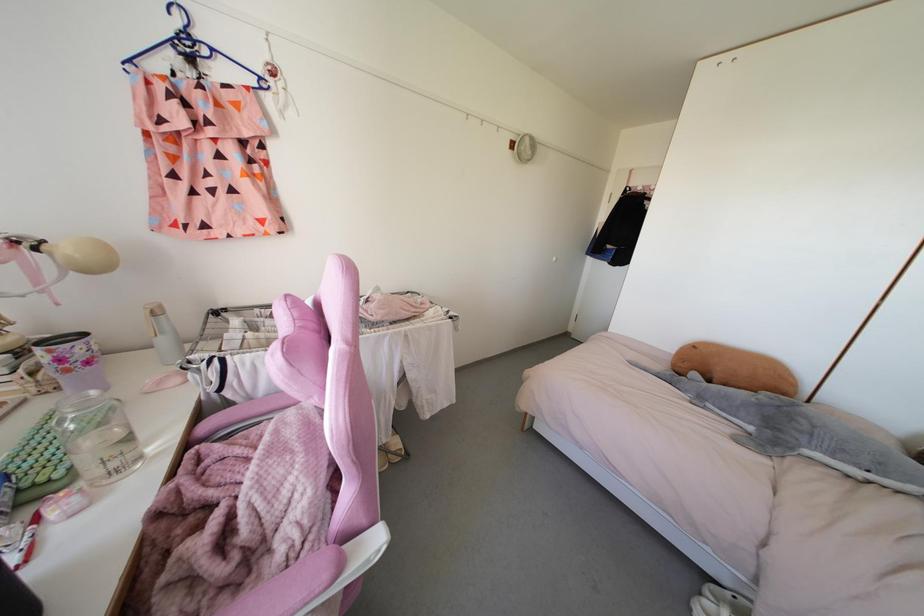
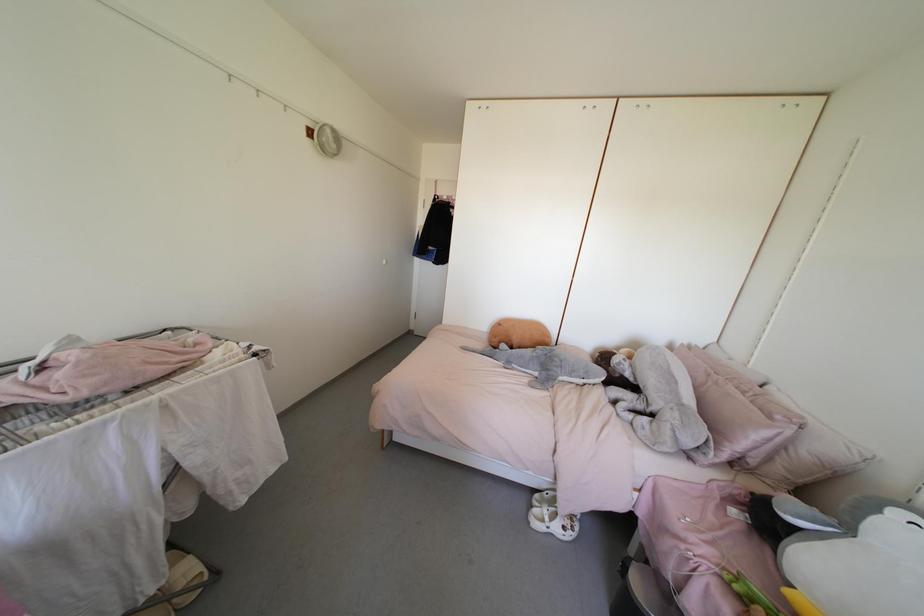
Question: Based on the continuous images, in which direction is the camera rotating? Reply with the corresponding letter.

Choices:
 (A) Left
 (B) Right
 (C) Up
 (D) Down

Answer: (B)